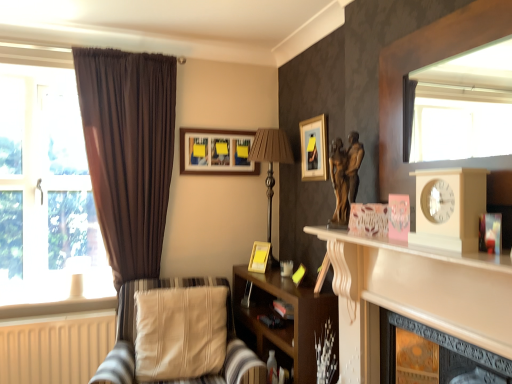
Question: Can you confirm if matte gold picture frame at upper center, which is the 3th picture frame in left-to-right order, is shorter than transparent glass window at left?

Choices:
 (A) yes
 (B) no

Answer: (A)

Question: Considering the relative sizes of matte gold picture frame at upper center, which is the 2th picture frame in bottom-to-top order, and transparent glass window at left in the image provided, is matte gold picture frame at upper center, which is the 2th picture frame in bottom-to-top order, thinner than transparent glass window at left?

Choices:
 (A) no
 (B) yes

Answer: (B)

Question: Would you say transparent glass window at left is part of matte gold picture frame at upper center, which is the 3th picture frame in left-to-right order,'s contents?

Choices:
 (A) yes
 (B) no

Answer: (B)

Question: Considering the relative sizes of matte gold picture frame at upper center, which is the 2th picture frame in bottom-to-top order, and transparent glass window at left in the image provided, is matte gold picture frame at upper center, which is the 2th picture frame in bottom-to-top order, taller than transparent glass window at left?

Choices:
 (A) no
 (B) yes

Answer: (A)

Question: Could you tell me if matte gold picture frame at upper center, the second picture frame positioned from the top, is facing transparent glass window at left?

Choices:
 (A) yes
 (B) no

Answer: (A)

Question: Is brown velvet curtain at left wider or thinner than brown fabric lamp at center, the second lamp positioned from the left?

Choices:
 (A) thin
 (B) wide

Answer: (A)

Question: Is brown velvet curtain at left in front of or behind brown fabric lamp at center, acting as the first lamp starting from the right, in the image?

Choices:
 (A) front
 (B) behind

Answer: (A)

Question: Considering the positions of brown velvet curtain at left and brown fabric lamp at center, which appears as the 2th lamp when ordered from the bottom, in the image, is brown velvet curtain at left bigger or smaller than brown fabric lamp at center, which appears as the 2th lamp when ordered from the bottom,?

Choices:
 (A) big
 (B) small

Answer: (A)

Question: Is point (130, 213) closer or farther from the camera than point (268, 215)?

Choices:
 (A) farther
 (B) closer

Answer: (B)

Question: Would you say beige wooden clock at right is inside or outside transparent glass window at left?

Choices:
 (A) outside
 (B) inside

Answer: (A)

Question: Visually, is beige wooden clock at right positioned to the left or to the right of transparent glass window at left?

Choices:
 (A) left
 (B) right

Answer: (B)

Question: In terms of size, does beige wooden clock at right appear bigger or smaller than transparent glass window at left?

Choices:
 (A) big
 (B) small

Answer: (B)

Question: Relative to transparent glass window at left, is beige wooden clock at right in front or behind?

Choices:
 (A) behind
 (B) front

Answer: (B)

Question: Would you say matte gold picture frame at upper center, arranged as the third picture frame when viewed from the back, is to the left or to the right of beige wooden clock at right in the picture?

Choices:
 (A) left
 (B) right

Answer: (A)

Question: Is matte gold picture frame at upper center, the 1th picture frame viewed from the right, taller or shorter than beige wooden clock at right?

Choices:
 (A) tall
 (B) short

Answer: (A)